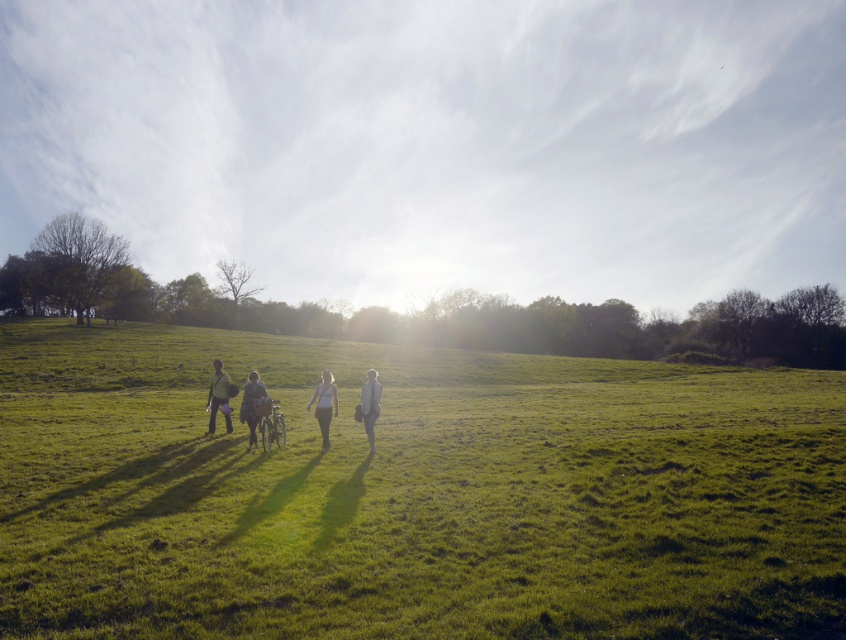
Is brown leather jacket at center taller than white matte shirt at center?

In fact, brown leather jacket at center may be shorter than white matte shirt at center.

Is brown leather jacket at center below white matte shirt at center?

No.

I want to click on brown leather jacket at center, so click(253, 403).

In the scene shown: Does green grass at center appear under brown leather jacket at center?

Correct, green grass at center is located below brown leather jacket at center.

Between green grass at center and brown leather jacket at center, which one appears on the right side from the viewer's perspective?

green grass at center is more to the right.

In order to click on green grass at center in this screenshot , I will do point(411,493).

Can you confirm if white matte shirt at center is smaller than light gray fabric jacket at center?

No.

Between point (321, 403) and point (365, 385), which one is positioned behind?

The point (321, 403) is more distant.

The image size is (846, 640). Find the location of `white matte shirt at center`. white matte shirt at center is located at coordinates (323, 404).